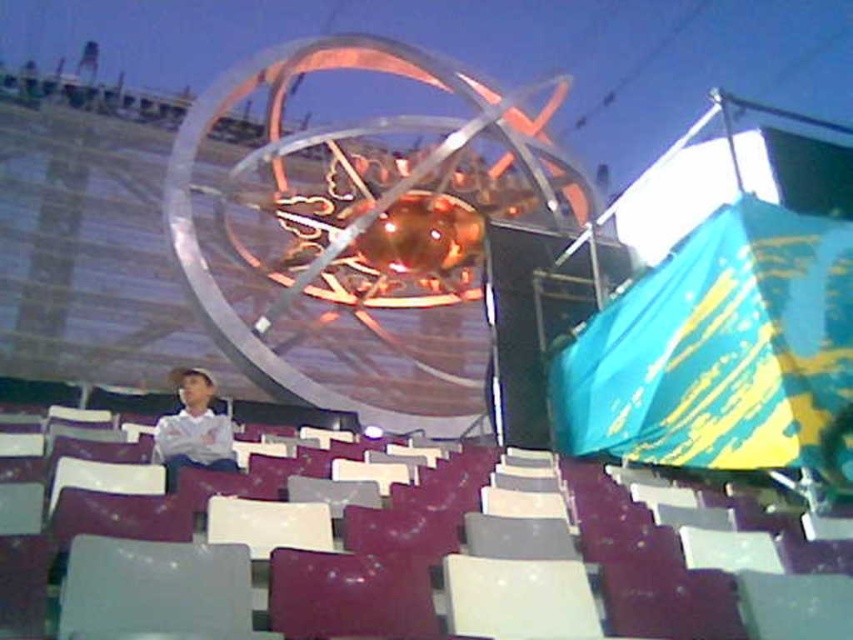
Between white plastic chair at center and white matte shirt at center, which one is positioned higher?

Positioned higher is white matte shirt at center.

Is white plastic chair at center shorter than white matte shirt at center?

Yes.

Who is more distant from viewer, (430, 616) or (184, 419)?

Answer: The point (184, 419) is more distant.

Locate an element on the screen. Image resolution: width=853 pixels, height=640 pixels. white plastic chair at center is located at coordinates (474, 561).